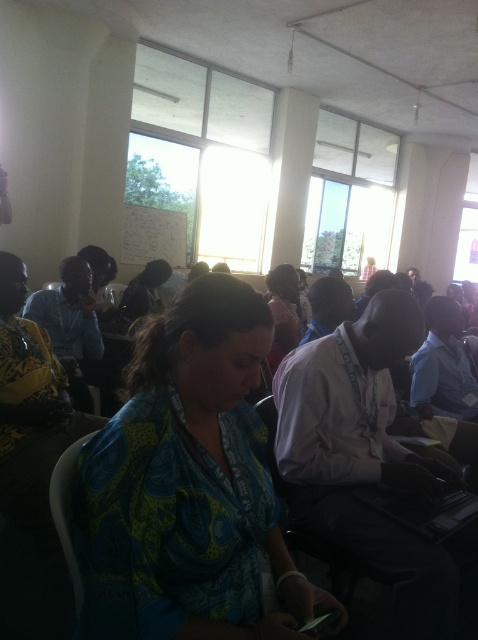
You are attending a meeting in this room and need to locate two attendees wearing shirts at the center of the image. The printed fabric shirt at center and the matte pink shirt at center. Which one is positioned to the left?

The printed fabric shirt at center is positioned to the left of the matte pink shirt at center.

You are organizing a clothing display and need to arrange the printed fabric shirt at center and the matte pink shirt at center side by side on a narrow shelf. Based on their sizes, which shirt should be placed first to ensure both fit on the shelf?

The printed fabric shirt at center has a larger width than the matte pink shirt at center, so place the matte pink shirt at center first on the shelf to accommodate the wider printed fabric shirt at center next without overcrowding.